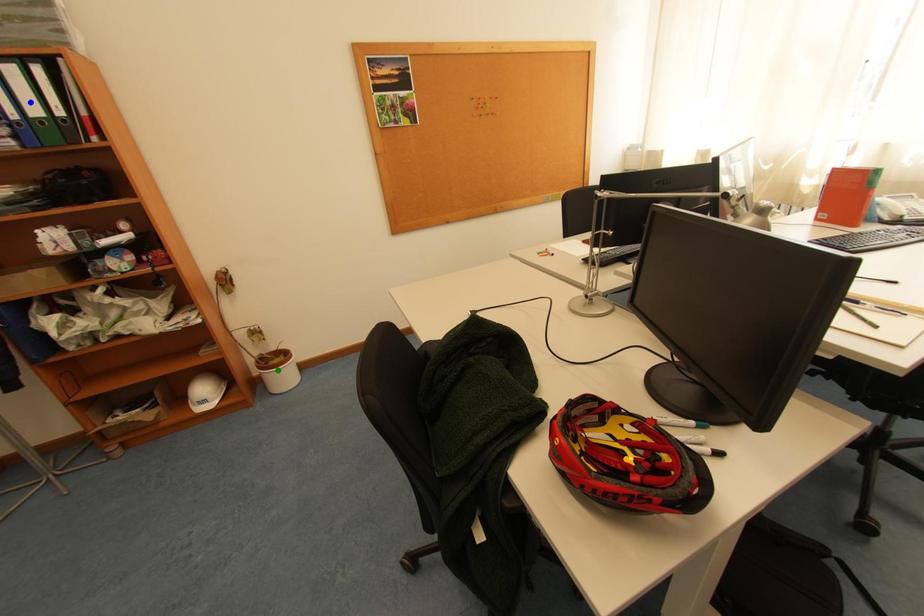
Order these from farthest to nearest:
green point, orange point, blue point

green point < blue point < orange point